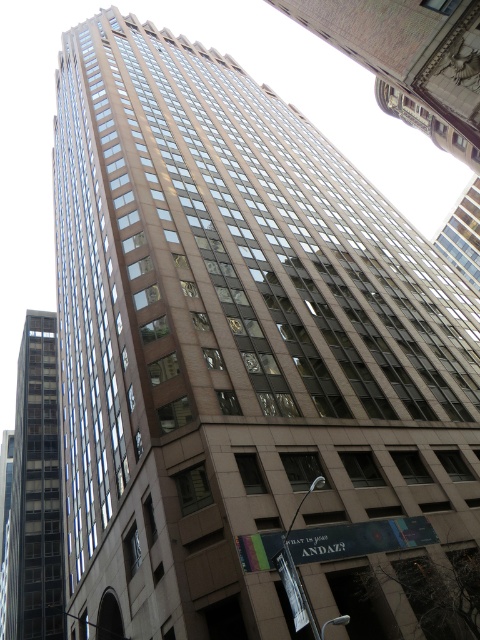
Based on the photo, you are standing in a park across from the glassy reflective building at upper center. You want to take a photo of it using a camera that can focus up to 20 meters. Will you be able to focus on the building?

The glassy reflective building at upper center is 21.44 meters away from the viewer. Since the camera can only focus up to 20 meters, you will not be able to focus on the building.

You are an architect evaluating two buildings in the cityscape. You need to determine which building is shorter between the glassy reflective building at upper center and the dark gray glass building at left. Based on the scene provided, which one is shorter?

The glassy reflective building at upper center is shorter than the dark gray glass building at left according to the description.

You are an architect analyzing the building layout. From your vantage point, does the glassy reflective building at upper center appear to be in front of or behind the dark gray glass building at left?

The glassy reflective building at upper center is positioned over dark gray glass building at left, so it appears to be in front of it.